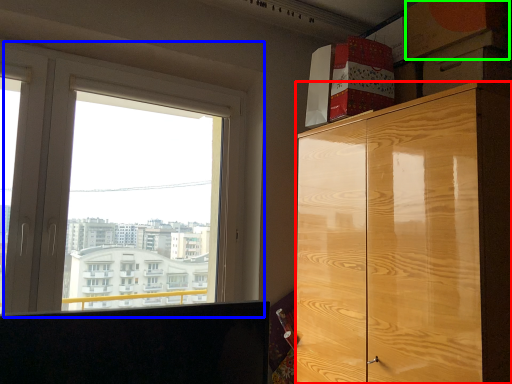
Question: Which is farther away from cabinetry (highlighted by a red box)? window (highlighted by a blue box) or cardboard box (highlighted by a green box)?

Choices:
 (A) window
 (B) cardboard box

Answer: (A)